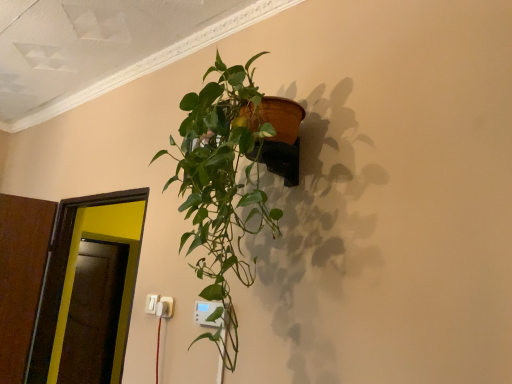
Question: Which direction should I rotate to look at white plastic electric outlet at lower center, acting as the 3th electric outlet starting from the back?

Choices:
 (A) right
 (B) left

Answer: (B)

Question: Which direction should I rotate to face white plastic electric outlet at lower center, the second electric outlet from the back, — up or down?

Choices:
 (A) up
 (B) down

Answer: (B)

Question: From the image's perspective, is white plastic electric outlet at lower left, which is the 1th electric outlet from left to right, on top of white plastic electric outlet at lower center, which is the 1th electric outlet from right to left?

Choices:
 (A) no
 (B) yes

Answer: (A)

Question: Can you confirm if white plastic electric outlet at lower left, which is the 1th electric outlet from left to right, is wider than white plastic electric outlet at lower center, which is the 1th electric outlet from right to left?

Choices:
 (A) no
 (B) yes

Answer: (A)

Question: Is white plastic electric outlet at lower left, the third electric outlet positioned from the front, completely or partially outside of white plastic electric outlet at lower center, which is the 1th electric outlet from right to left?

Choices:
 (A) yes
 (B) no

Answer: (A)

Question: Considering the relative sizes of white plastic electric outlet at lower left, the third electric outlet positioned from the front, and white plastic electric outlet at lower center, acting as the 3th electric outlet starting from the back, in the image provided, is white plastic electric outlet at lower left, the third electric outlet positioned from the front, smaller than white plastic electric outlet at lower center, acting as the 3th electric outlet starting from the back,?

Choices:
 (A) no
 (B) yes

Answer: (B)

Question: Considering the relative sizes of white plastic electric outlet at lower left, the third electric outlet viewed from the right, and white plastic electric outlet at lower center, acting as the 3th electric outlet starting from the left, in the image provided, is white plastic electric outlet at lower left, the third electric outlet viewed from the right, taller than white plastic electric outlet at lower center, acting as the 3th electric outlet starting from the left,?

Choices:
 (A) no
 (B) yes

Answer: (A)

Question: Is white plastic electric outlet at lower left, positioned as the first electric outlet in back-to-front order, far away from white plastic electric outlet at lower center, acting as the 3th electric outlet starting from the back?

Choices:
 (A) no
 (B) yes

Answer: (A)

Question: From a real-world perspective, is white plastic electric outlet at lower center, the second electric outlet from the back, beneath transparent glass door at left?

Choices:
 (A) yes
 (B) no

Answer: (A)

Question: Could you tell me if white plastic electric outlet at lower center, which is the 2th electric outlet in front-to-back order, is facing transparent glass door at left?

Choices:
 (A) no
 (B) yes

Answer: (A)

Question: Is white plastic electric outlet at lower center, positioned as the 2th electric outlet in left-to-right order, turned away from transparent glass door at left?

Choices:
 (A) no
 (B) yes

Answer: (A)

Question: From the image's perspective, is white plastic electric outlet at lower center, the second electric outlet in the right-to-left sequence, located above transparent glass door at left?

Choices:
 (A) no
 (B) yes

Answer: (B)

Question: Is white plastic electric outlet at lower center, the second electric outlet in the right-to-left sequence, closer to camera compared to transparent glass door at left?

Choices:
 (A) no
 (B) yes

Answer: (B)

Question: Does white plastic electric outlet at lower center, the second electric outlet in the right-to-left sequence, contain transparent glass door at left?

Choices:
 (A) no
 (B) yes

Answer: (A)

Question: From the image's perspective, is white plastic electric outlet at lower left, the third electric outlet positioned from the front, above white plastic electric outlet at lower center, the second electric outlet from the back?

Choices:
 (A) yes
 (B) no

Answer: (B)